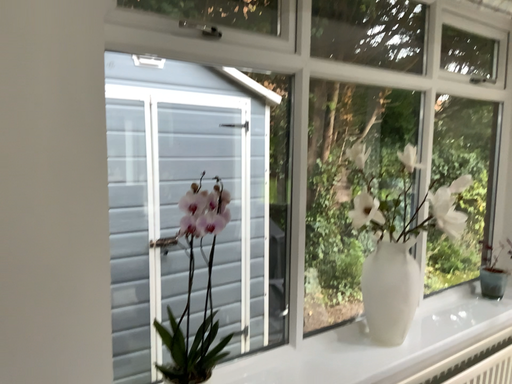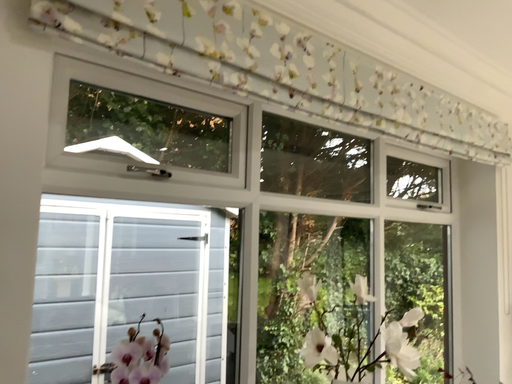
Question: How did the camera likely rotate when shooting the video?

Choices:
 (A) rotated upward
 (B) rotated downward

Answer: (A)